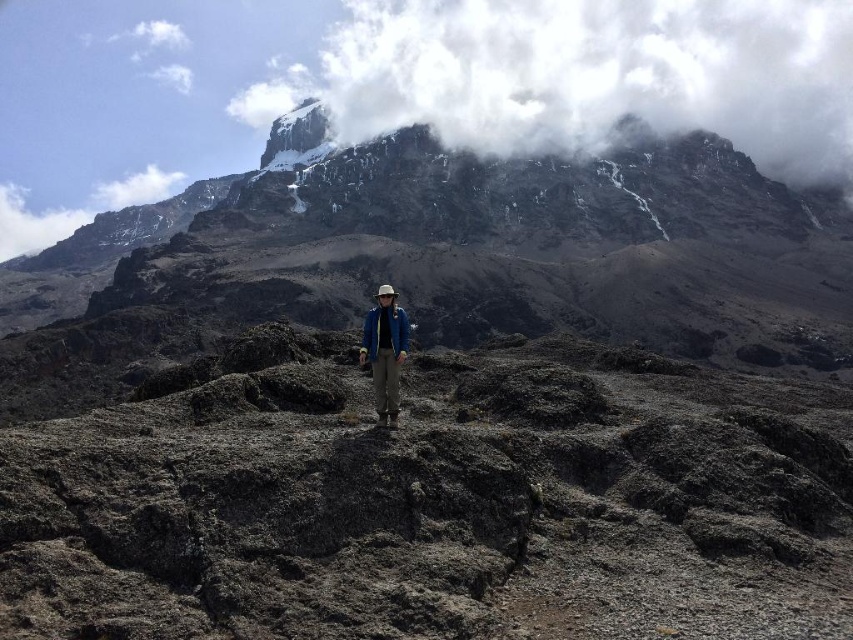
You are a hiker planning to take a photo of the rugged rock mountain at center and the white fluffy cloud at upper center. From your current position, which object will appear closer to you in the photo?

The rugged rock mountain at center will appear closer to you in the photo because it is positioned in front of the white fluffy cloud at upper center, making it the foreground element.

You are a hiker standing on the dark gray rock at center. You want to take a photo of the white fluffy cloud at upper center. Considering the distance between them, do you think you can capture the entire cloud in your smartphone camera without zooming in?

The dark gray rock at center is 886.25 feet from the white fluffy cloud at upper center. Since the distance is quite large, it might be challenging to capture the entire cloud in a smartphone camera without zooming in, as the cloud would appear small in the frame.

Looking at this image, you are a photographer standing at the camera position. You want to capture a photo of the point at coordinates point (724, 188). The camera has a focal length of 50mm and a sensor size of 24mm x 36mm. What is the minimum distance you need to move towards the point to ensure it fills the frame vertically? Assume the point is a small object with a height of 1 meter.

The point at coordinates point (724, 188) is currently 254.55 meters away. To fill the frame vertically with a 1 meter tall object using a 50mm lens on a 24mm sensor, the required distance is calculated using the formula distance sensor height divided by object height multiplied by focal length. The sensor height is 24mm, so 24mm divided by 1000mm to meters is 0.024 meters. 0.024 meters divided by 1 meter equals 0.024. Multiply by focal length 0.05 meters gives 0.0012 meters. Wait this doesn